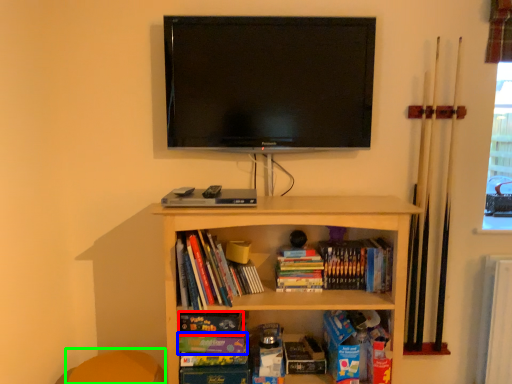
Question: Based on their relative distances, which object is farther from paperback book (highlighted by a red box)? Choose from paperback book (highlighted by a blue box) and swivel chair (highlighted by a green box).

Choices:
 (A) paperback book
 (B) swivel chair

Answer: (B)